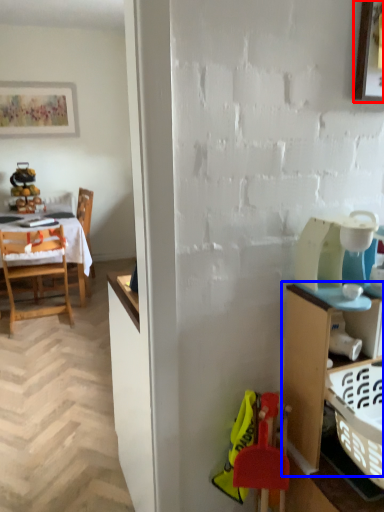
Question: Among these objects, which one is nearest to the camera, picture frame (highlighted by a red box) or cabinetry (highlighted by a blue box)?

Choices:
 (A) picture frame
 (B) cabinetry

Answer: (B)